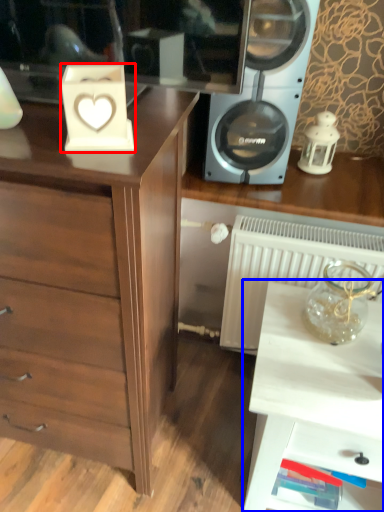
Question: Which point is further to the camera, appliance (highlighted by a red box) or table (highlighted by a blue box)?

Choices:
 (A) appliance
 (B) table

Answer: (B)